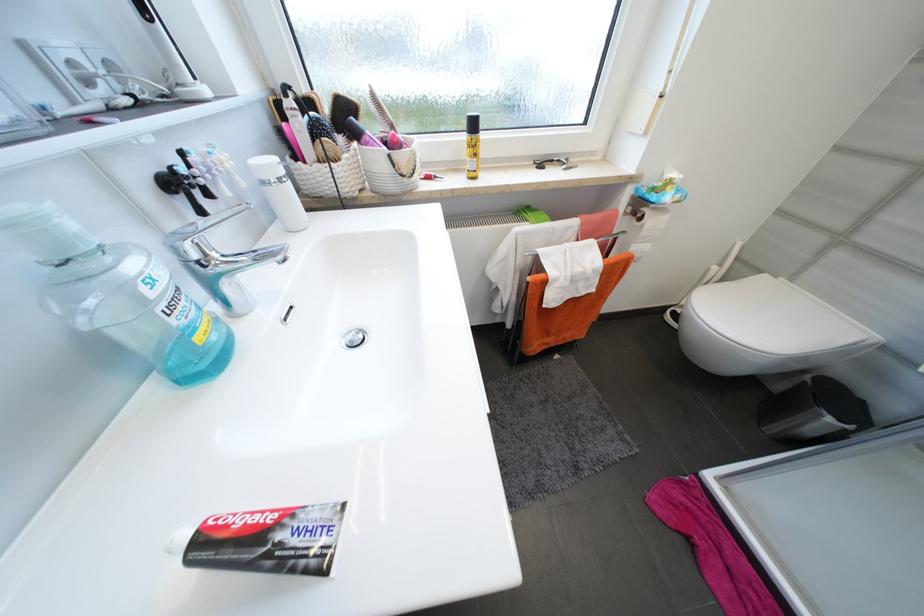
This screenshot has width=924, height=616. Find the location of `pink hairbrush`. pink hairbrush is located at coordinates (711, 546).